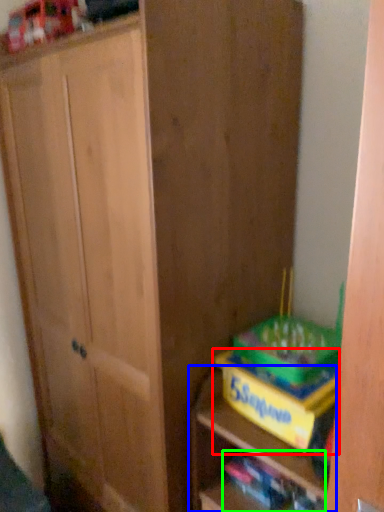
Question: Which object is positioned closest to cabinetry (highlighted by a red box)? Select from shelf (highlighted by a blue box) and book (highlighted by a green box).

Choices:
 (A) shelf
 (B) book

Answer: (A)